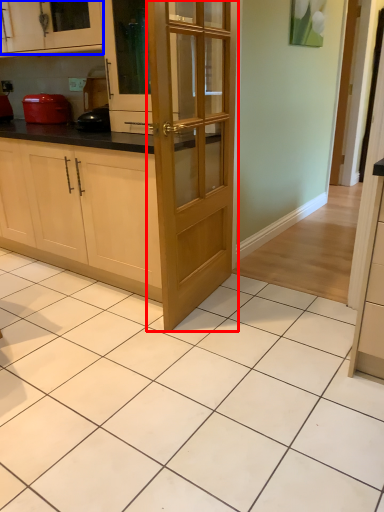
Question: Which point is further to the camera, door (highlighted by a red box) or cabinetry (highlighted by a blue box)?

Choices:
 (A) door
 (B) cabinetry

Answer: (B)